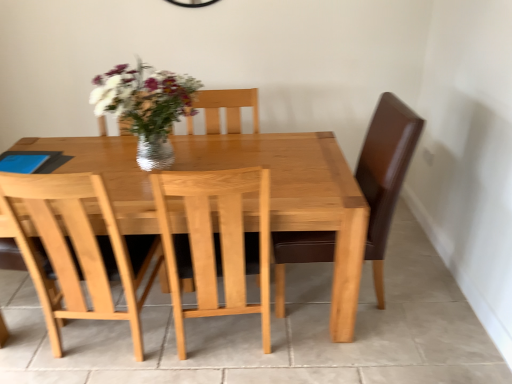
Image resolution: width=512 pixels, height=384 pixels. I want to click on light brown wooden table at center, so click(x=298, y=198).

Image resolution: width=512 pixels, height=384 pixels. I want to click on light brown wooden table at center, so click(x=298, y=198).

Is there a large distance between shiny silver vase at center and light wood chair at center?

They are positioned close to each other.

Where is `floral arrangement that appears above the light wood chair at center (from the image's perspective)`? This screenshot has height=384, width=512. floral arrangement that appears above the light wood chair at center (from the image's perspective) is located at coordinates [146, 107].

Which is correct: light brown wooden table at center is inside light wood chair at center, or outside of it?

light brown wooden table at center is located beyond the bounds of light wood chair at center.

The height and width of the screenshot is (384, 512). I want to click on chair on the right side of light brown wooden table at center, so click(216, 243).

Can you confirm if light brown wooden table at center is smaller than light wood chair at center?

No.

Is the surface of light brown wooden table at center in direct contact with light wood chair at center?

light brown wooden table at center and light wood chair at center are clearly separated.

What's the angular difference between shiny silver vase at center and light brown wooden table at center's facing directions?

The facing directions of shiny silver vase at center and light brown wooden table at center are 0.104 degrees apart.

Can you confirm if shiny silver vase at center is shorter than light brown wooden table at center?

Indeed, shiny silver vase at center has a lesser height compared to light brown wooden table at center.

Based on their sizes in the image, would you say shiny silver vase at center is bigger or smaller than light brown wooden table at center?

Considering their sizes, shiny silver vase at center takes up less space than light brown wooden table at center.

Is shiny silver vase at center next to light brown wooden table at center and touching it?

They are not placed beside each other.

Is shiny silver vase at center at the back of light brown wooden table at center?

No, light brown wooden table at center's orientation is not away from shiny silver vase at center.

Does point (359, 227) appear closer or farther from the camera than point (94, 82)?

Point (359, 227).

Can you tell me how much light brown wooden table at center and shiny silver vase at center differ in facing direction?

0.104 degrees separate the facing orientations of light brown wooden table at center and shiny silver vase at center.

Considering the relative sizes of light brown wooden table at center and shiny silver vase at center in the image provided, is light brown wooden table at center smaller than shiny silver vase at center?

Actually, light brown wooden table at center might be larger than shiny silver vase at center.

Is light wood chair at center bigger or smaller than light brown wooden table at center?

Considering their sizes, light wood chair at center takes up less space than light brown wooden table at center.

This screenshot has width=512, height=384. Identify the location of kitchen & dining room table below the light wood chair at center (from a real-world perspective). (x=298, y=198).

Would you say light wood chair at center is inside or outside light brown wooden table at center?

light wood chair at center exists entirely within light brown wooden table at center.

Which object is closer to the camera, light wood chair at center or light brown wooden table at center?

light wood chair at center is closer to the camera.

From the image's perspective, between light wood chair at center and shiny silver vase at center, who is located below?

light wood chair at center is shown below in the image.

From the picture: Does light wood chair at center have a greater height compared to shiny silver vase at center?

Yes, light wood chair at center is taller than shiny silver vase at center.

Is light wood chair at center positioned before shiny silver vase at center?

Yes, light wood chair at center is in front of shiny silver vase at center.

Which of these two, light wood chair at center or shiny silver vase at center, is smaller?

shiny silver vase at center is smaller.

You are a GUI agent. You are given a task and a screenshot of the screen. Output one action in this format:
    pyautogui.click(x=<x>, y=<y>)
    Task: Click on the chair below the shiny silver vase at center (from the image's perspective)
    
    Given the screenshot: What is the action you would take?
    pyautogui.click(x=216, y=243)

Find the location of a particular element. The width and height of the screenshot is (512, 384). chair in front of the light brown wooden table at center is located at coordinates (216, 243).

Looking at the image, which one is located further to light brown wooden table at center, shiny silver vase at center or light wood chair at center?

The object further to light brown wooden table at center is shiny silver vase at center.

From the picture: Considering their positions, is light wood chair at center positioned further to shiny silver vase at center than light brown wooden table at center?

light wood chair at center is positioned further to the anchor shiny silver vase at center.

Considering their positions, is light wood chair at center positioned further to light brown wooden table at center than shiny silver vase at center?

Based on the image, shiny silver vase at center appears to be further to light brown wooden table at center.

Looking at the image, which one is located further to light wood chair at center, light brown wooden table at center or shiny silver vase at center?

shiny silver vase at center lies further to light wood chair at center than the other object.

Estimate the real-world distances between objects in this image. Which object is further from light wood chair at center, shiny silver vase at center or light brown wooden table at center?

shiny silver vase at center is further to light wood chair at center.

Which object lies further to the anchor point shiny silver vase at center, light brown wooden table at center or light wood chair at center?

Among the two, light wood chair at center is located further to shiny silver vase at center.

Find the location of a particular element. The width and height of the screenshot is (512, 384). kitchen & dining room table between shiny silver vase at center and light wood chair at center from top to bottom is located at coordinates (298, 198).